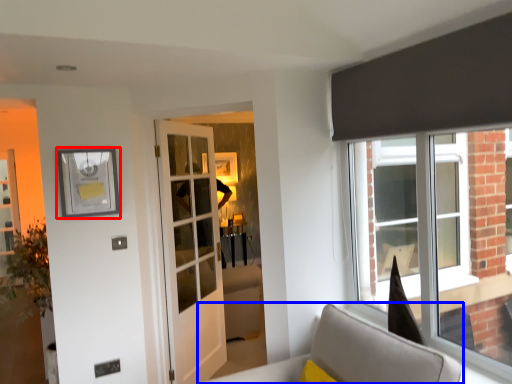
Question: Which object is further to the camera taking this photo, picture frame (highlighted by a red box) or furniture (highlighted by a blue box)?

Choices:
 (A) picture frame
 (B) furniture

Answer: (A)